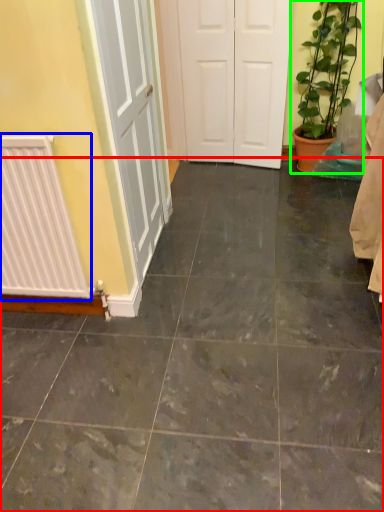
Question: Which object is the closest to the ceramic tile (highlighted by a red box)? Choose among these: radiator (highlighted by a blue box) or houseplant (highlighted by a green box).

Choices:
 (A) radiator
 (B) houseplant

Answer: (A)